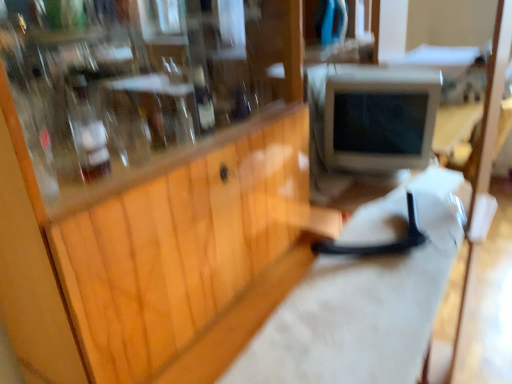
Question: Is there a large distance between white matte workbench at center and wooden cabinet at center?

Choices:
 (A) no
 (B) yes

Answer: (A)

Question: Does white matte workbench at center come in front of wooden cabinet at center?

Choices:
 (A) yes
 (B) no

Answer: (B)

Question: Can you confirm if white matte workbench at center is thinner than wooden cabinet at center?

Choices:
 (A) no
 (B) yes

Answer: (B)

Question: Is white matte workbench at center positioned with its back to wooden cabinet at center?

Choices:
 (A) no
 (B) yes

Answer: (B)

Question: Could you tell me if white matte workbench at center is turned towards wooden cabinet at center?

Choices:
 (A) no
 (B) yes

Answer: (A)

Question: From the image's perspective, relative to wooden cabinet at center, is translucent glass bottle at upper left, the second bottle when ordered from back to front, above or below?

Choices:
 (A) above
 (B) below

Answer: (A)

Question: In terms of height, does translucent glass bottle at upper left, which is counted as the first bottle, starting from the left, look taller or shorter compared to wooden cabinet at center?

Choices:
 (A) short
 (B) tall

Answer: (A)

Question: Relative to wooden cabinet at center, is translucent glass bottle at upper left, which is counted as the first bottle, starting from the left, in front or behind?

Choices:
 (A) behind
 (B) front

Answer: (A)

Question: Does point (78, 157) appear closer or farther from the camera than point (106, 286)?

Choices:
 (A) closer
 (B) farther

Answer: (B)

Question: From the image's perspective, is wooden cabinet at center located above or below translucent glass bottle at center, the first bottle when ordered from back to front?

Choices:
 (A) below
 (B) above

Answer: (A)

Question: Is wooden cabinet at center spatially inside translucent glass bottle at center, which is the 2th bottle in front-to-back order, or outside of it?

Choices:
 (A) inside
 (B) outside

Answer: (B)

Question: Does point (262, 140) appear closer or farther from the camera than point (207, 115)?

Choices:
 (A) closer
 (B) farther

Answer: (B)

Question: Based on their positions, is wooden cabinet at center located to the left or right of translucent glass bottle at center, which is the 2th bottle in front-to-back order?

Choices:
 (A) right
 (B) left

Answer: (B)

Question: Is translucent glass bottle at center, which is the second bottle from left to right, inside or outside of translucent glass bottle at upper left, the 2th bottle in the right-to-left sequence?

Choices:
 (A) outside
 (B) inside

Answer: (A)

Question: Considering the positions of translucent glass bottle at center, the first bottle when ordered from back to front, and translucent glass bottle at upper left, the 2th bottle in the right-to-left sequence, in the image, is translucent glass bottle at center, the first bottle when ordered from back to front, bigger or smaller than translucent glass bottle at upper left, the 2th bottle in the right-to-left sequence,?

Choices:
 (A) big
 (B) small

Answer: (B)